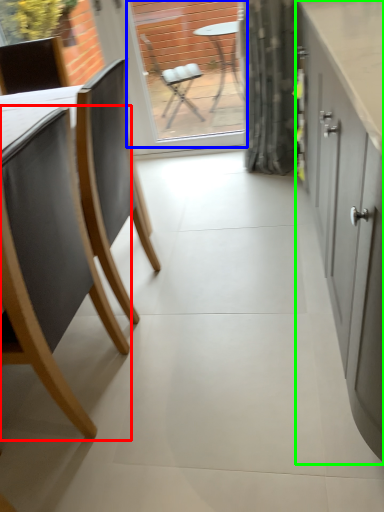
Question: Estimate the real-world distances between objects in this image. Which object is closer to chair (highlighted by a red box), window screen (highlighted by a blue box) or cabinetry (highlighted by a green box)?

Choices:
 (A) window screen
 (B) cabinetry

Answer: (B)